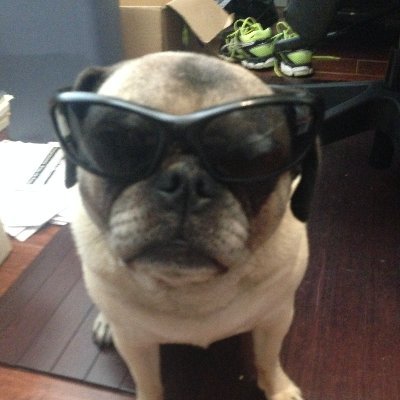
At what (x,y) coordinates should I click in order to perform the action: click on floor. Please return your answer as a coordinate pair (x, y). The image size is (400, 400). Looking at the image, I should click on (45, 385).